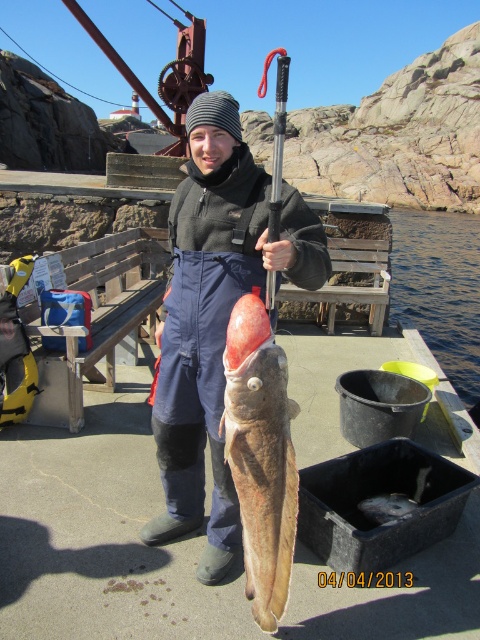
Can you confirm if dark blue waterproof suit at center is positioned to the left of smooth brown fish at center?

Indeed, dark blue waterproof suit at center is positioned on the left side of smooth brown fish at center.

Between dark blue waterproof suit at center and smooth brown fish at center, which one is positioned lower?

smooth brown fish at center

Is point (199, 292) less distant than point (249, 355)?

No, it is behind (249, 355).

Where is `dark blue waterproof suit at center`? This screenshot has height=640, width=480. dark blue waterproof suit at center is located at coordinates (216, 316).

Does point (214, 284) come closer to viewer compared to point (373, 513)?

Yes.

Measure the distance between dark blue waterproof suit at center and shiny silver fish at center.

A distance of 1.41 meters exists between dark blue waterproof suit at center and shiny silver fish at center.

Where is `dark blue waterproof suit at center`? dark blue waterproof suit at center is located at coordinates (216, 316).

Image resolution: width=480 pixels, height=640 pixels. Describe the element at coordinates (261, 456) in the screenshot. I see `smooth brown fish at center` at that location.

Where is `smooth brown fish at center`? This screenshot has height=640, width=480. smooth brown fish at center is located at coordinates (261, 456).